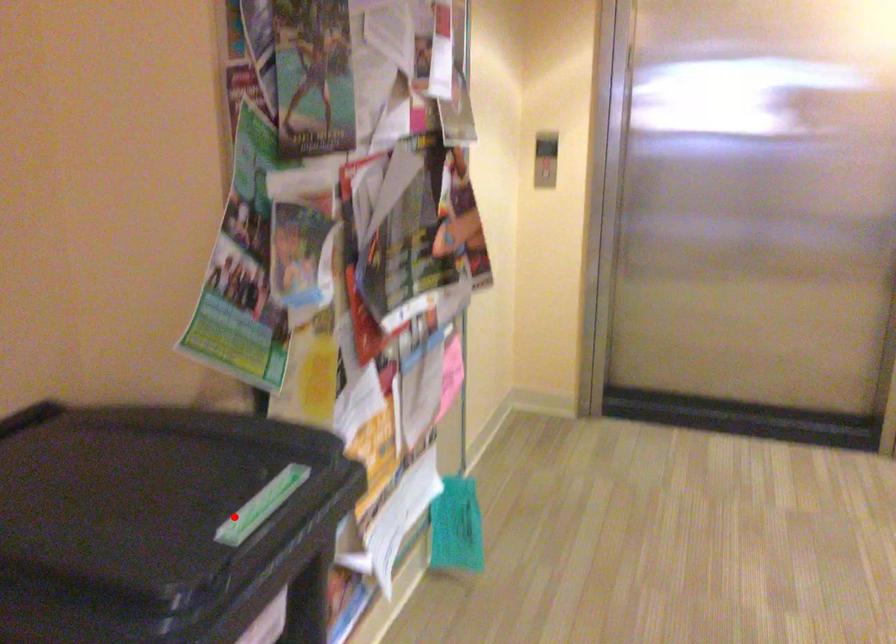
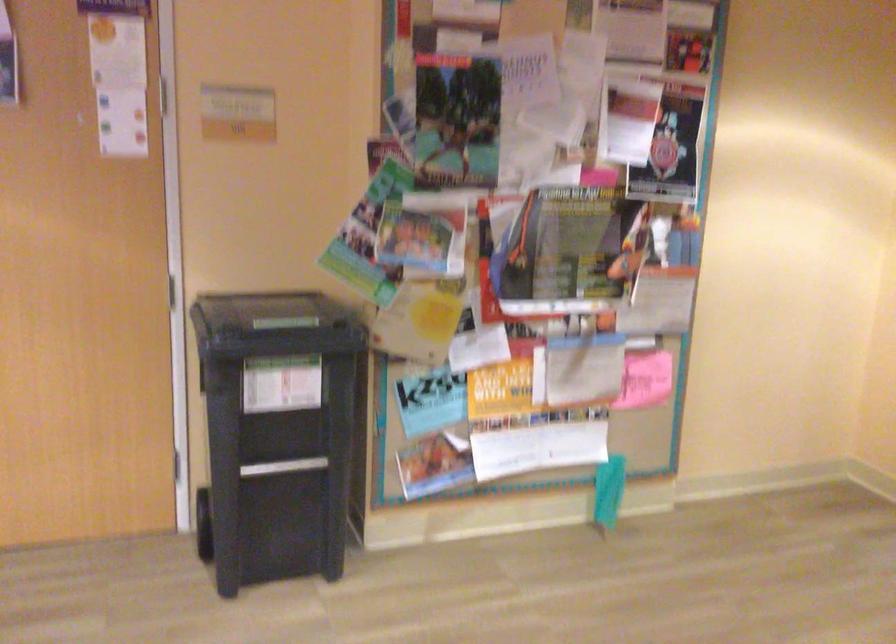
Locate, in the second image, the point that corresponds to the highlighted location in the first image.

(273, 325)